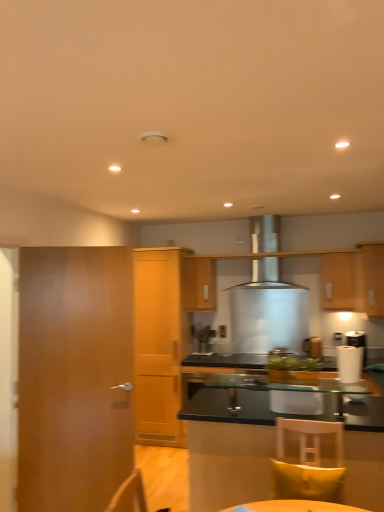
Measure the distance between point [226,400] and camera.

Point [226,400] is 3.02 meters from camera.

I want to click on satin silver coffee machine at center, so click(x=203, y=336).

Looking at this image, how many degrees apart are the facing directions of transparent glass cabinet at lower right, which appears as the 5th cabinetry when viewed from the back, and wooden door at left?

The facing directions of transparent glass cabinet at lower right, which appears as the 5th cabinetry when viewed from the back, and wooden door at left are 160 degrees apart.

Considering the relative positions of transparent glass cabinet at lower right, which appears as the 5th cabinetry when viewed from the back, and wooden door at left in the image provided, is transparent glass cabinet at lower right, which appears as the 5th cabinetry when viewed from the back, to the left or to the right of wooden door at left?

transparent glass cabinet at lower right, which appears as the 5th cabinetry when viewed from the back, is to the right of wooden door at left.

This screenshot has height=512, width=384. Identify the location of door located on the left of transparent glass cabinet at lower right, arranged as the 1th cabinetry when viewed from the front. (74, 377).

Considering the sizes of objects transparent glass cabinet at lower right, arranged as the 1th cabinetry when viewed from the front, and wooden door at left in the image provided, who is shorter, transparent glass cabinet at lower right, arranged as the 1th cabinetry when viewed from the front, or wooden door at left?

Standing shorter between the two is transparent glass cabinet at lower right, arranged as the 1th cabinetry when viewed from the front.

Based on their positions, is wooden cabinet at upper right, the 3th cabinetry positioned from the front, located to the left or right of wooden cabinet at center, marked as the fifth cabinetry in a front-to-back arrangement?

wooden cabinet at upper right, the 3th cabinetry positioned from the front, is to the right of wooden cabinet at center, marked as the fifth cabinetry in a front-to-back arrangement.

Consider the image. From the image's perspective, is wooden cabinet at upper right, the 3th cabinetry when ordered from back to front, positioned above or below wooden cabinet at center, placed as the 1th cabinetry when sorted from back to front?

wooden cabinet at upper right, the 3th cabinetry when ordered from back to front, is situated higher than wooden cabinet at center, placed as the 1th cabinetry when sorted from back to front, in the image.

In the scene shown: Considering the sizes of light wood cabinet at center, the 4th cabinetry viewed from the front, and transparent glass countertop at center in the image, is light wood cabinet at center, the 4th cabinetry viewed from the front, taller or shorter than transparent glass countertop at center?

light wood cabinet at center, the 4th cabinetry viewed from the front, is taller than transparent glass countertop at center.

Looking at their sizes, would you say light wood cabinet at center, the 4th cabinetry viewed from the front, is wider or thinner than transparent glass countertop at center?

Clearly, light wood cabinet at center, the 4th cabinetry viewed from the front, has more width compared to transparent glass countertop at center.

Looking at this image, does light wood cabinet at center, the 2th cabinetry positioned from the back, have a smaller size compared to transparent glass countertop at center?

No.

How many degrees apart are the facing directions of light wood cabinet at center, the 2th cabinetry positioned from the back, and transparent glass countertop at center?

light wood cabinet at center, the 2th cabinetry positioned from the back, and transparent glass countertop at center are facing 180 degrees away from each other.

Which object is thinner, satin silver coffee machine at center or wooden cabinet at center, marked as the fifth cabinetry in a front-to-back arrangement?

With smaller width is satin silver coffee machine at center.

Which cabinetry is the 1st one when counting from the left side of the satin silver coffee machine at center? Please provide its 2D coordinates.

[(200, 284)]

Considering the relative sizes of satin silver coffee machine at center and wooden cabinet at center, marked as the fifth cabinetry in a front-to-back arrangement, in the image provided, is satin silver coffee machine at center smaller than wooden cabinet at center, marked as the fifth cabinetry in a front-to-back arrangement,?

Yes, satin silver coffee machine at center is smaller than wooden cabinet at center, marked as the fifth cabinetry in a front-to-back arrangement.

Is satin silver coffee machine at center oriented towards wooden cabinet at center, marked as the fifth cabinetry in a front-to-back arrangement?

No.

From the picture: Is light wood cabinet at center, the 2th cabinetry positioned from the back, positioned beyond the bounds of white glossy armchair at center?

light wood cabinet at center, the 2th cabinetry positioned from the back, is positioned outside white glossy armchair at center.

From a real-world perspective, is light wood cabinet at center, the 2th cabinetry positioned from the back, on top of white glossy armchair at center?

Indeed, from a real-world perspective, light wood cabinet at center, the 2th cabinetry positioned from the back, stands above white glossy armchair at center.

Is light wood cabinet at center, the 4th cabinetry viewed from the front, oriented away from white glossy armchair at center?

No, white glossy armchair at center is not at the back of light wood cabinet at center, the 4th cabinetry viewed from the front.

From the image's perspective, between light wood cabinet at center, the 4th cabinetry viewed from the front, and white glossy armchair at center, who is located below?

light wood cabinet at center, the 4th cabinetry viewed from the front, appears lower in the image.

Measure the distance between light wood cabinet at center, the 2th cabinetry positioned from the back, and yellow fabric pillow at lower right.

The distance of light wood cabinet at center, the 2th cabinetry positioned from the back, from yellow fabric pillow at lower right is 2.52 meters.

From a real-world perspective, who is located higher, light wood cabinet at center, the 2th cabinetry positioned from the back, or yellow fabric pillow at lower right?

light wood cabinet at center, the 2th cabinetry positioned from the back, is physically above.

Is light wood cabinet at center, the 2th cabinetry positioned from the back, situated inside yellow fabric pillow at lower right or outside?

The correct answer is: outside.

Where is `cabinetry that is the 1st one when counting upward from the yellow fabric pillow at lower right (from the image's perspective)`? The height and width of the screenshot is (512, 384). cabinetry that is the 1st one when counting upward from the yellow fabric pillow at lower right (from the image's perspective) is located at coordinates (159, 344).

Can wooden door at left be found inside satin silver range hood at center?

No, wooden door at left is not a part of satin silver range hood at center.

Which of these two, satin silver range hood at center or wooden door at left, is smaller?

With smaller size is wooden door at left.

Where is `kitchen appliance on the right of wooden door at left`? kitchen appliance on the right of wooden door at left is located at coordinates (265, 234).

Locate an element on the screen. This screenshot has width=384, height=512. door behind the transparent glass cabinet at lower right, arranged as the 1th cabinetry when viewed from the front is located at coordinates (74, 377).

Find the location of a particular element. This screenshot has width=384, height=512. the 1st cabinetry positioned above the wooden cabinet at center, marked as the fifth cabinetry in a front-to-back arrangement (from the image's perspective) is located at coordinates (342, 282).

Looking at the image, which one is located closer to white glossy armchair at center, transparent glass cabinet at lower right, which appears as the 5th cabinetry when viewed from the back, or satin silver coffee machine at center?

transparent glass cabinet at lower right, which appears as the 5th cabinetry when viewed from the back, lies closer to white glossy armchair at center than the other object.

When comparing their distances from satin silver range hood at center, does white glossy armchair at center or transparent glass countertop at center seem closer?

transparent glass countertop at center.

Estimate the real-world distances between objects in this image. Which object is closer to transparent glass cabinet at lower right, which appears as the 5th cabinetry when viewed from the back, wooden cabinet at upper right, the 3th cabinetry positioned from the front, or transparent glass countertop at center?

Among the two, transparent glass countertop at center is located nearer to transparent glass cabinet at lower right, which appears as the 5th cabinetry when viewed from the back.

When comparing their distances from transparent glass cabinet at lower right, which appears as the 5th cabinetry when viewed from the back, does wooden door at left or satin silver range hood at center seem closer?

wooden door at left lies closer to transparent glass cabinet at lower right, which appears as the 5th cabinetry when viewed from the back, than the other object.

Looking at the image, which one is located further to white glossy armchair at center, wooden cabinet at right, the second cabinetry in the front-to-back sequence, or yellow fabric pillow at lower right?

wooden cabinet at right, the second cabinetry in the front-to-back sequence.

From the image, which object appears to be nearer to transparent glass cabinet at lower right, which appears as the 5th cabinetry when viewed from the back, wooden door at left or satin silver coffee machine at center?

Based on the image, wooden door at left appears to be nearer to transparent glass cabinet at lower right, which appears as the 5th cabinetry when viewed from the back.

When comparing their distances from wooden door at left, does satin silver coffee machine at center or white glossy armchair at center seem closer?

white glossy armchair at center.

Looking at the image, which one is located closer to wooden door at left, satin silver coffee machine at center or wooden cabinet at upper right, the 3th cabinetry positioned from the front?

satin silver coffee machine at center is closer to wooden door at left.

This screenshot has width=384, height=512. Find the location of `door located between transparent glass countertop at center and wooden cabinet at center, marked as the fifth cabinetry in a front-to-back arrangement, in the depth direction`. door located between transparent glass countertop at center and wooden cabinet at center, marked as the fifth cabinetry in a front-to-back arrangement, in the depth direction is located at coordinates (74, 377).

Identify the location of kitchen appliance positioned between wooden door at left and wooden cabinet at center, marked as the fifth cabinetry in a front-to-back arrangement, from near to far. (265, 234).

At what (x,y) coordinates should I click in order to perform the action: click on kitchen appliance between satin silver coffee machine at center and wooden cabinet at right, the second cabinetry in the front-to-back sequence, in the horizontal direction. Please return your answer as a coordinate pair (x, y). Image resolution: width=384 pixels, height=512 pixels. Looking at the image, I should click on (x=265, y=234).

Where is `armchair between transparent glass countertop at center and light wood cabinet at center, the 4th cabinetry viewed from the front, along the z-axis`? armchair between transparent glass countertop at center and light wood cabinet at center, the 4th cabinetry viewed from the front, along the z-axis is located at coordinates (296, 402).